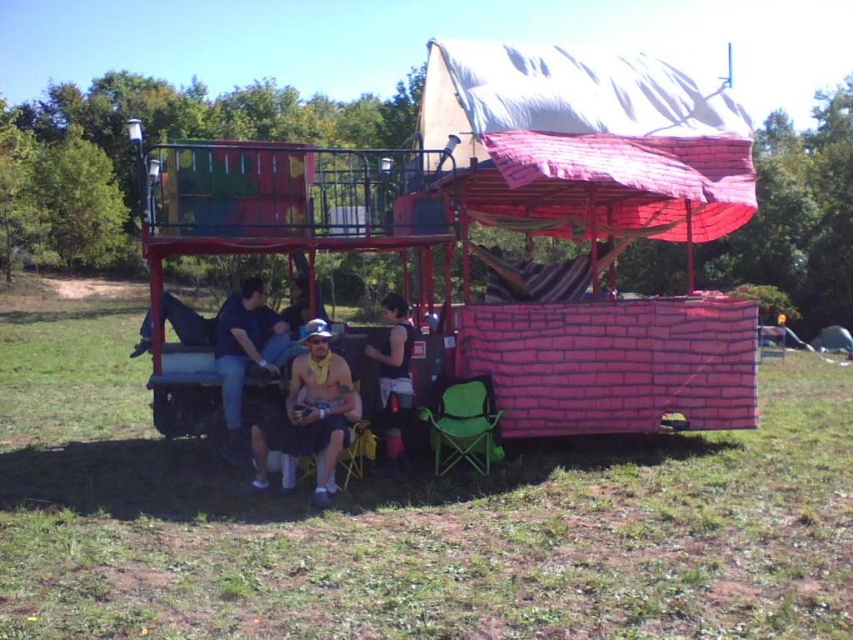
Question: Which point is closer to the camera?

Choices:
 (A) (294, 436)
 (B) (444, 388)
 (C) (396, 376)

Answer: (A)

Question: Based on their relative distances, which object is farther from the naked skin at center?

Choices:
 (A) black fabric bag at center
 (B) dark blue jeans at lower center

Answer: (A)

Question: Is naked skin at center to the left of green fabric chair at lower center from the viewer's perspective?

Choices:
 (A) yes
 (B) no

Answer: (A)

Question: Which of these objects is positioned closest to the naked skin at center?

Choices:
 (A) dark blue jeans at lower center
 (B) green fabric chair at lower center

Answer: (A)

Question: Can you confirm if naked skin at center is bigger than black fabric bag at center?

Choices:
 (A) no
 (B) yes

Answer: (A)

Question: Observing the image, what is the correct spatial positioning of naked skin at center in reference to dark blue jeans at lower center?

Choices:
 (A) below
 (B) above

Answer: (A)